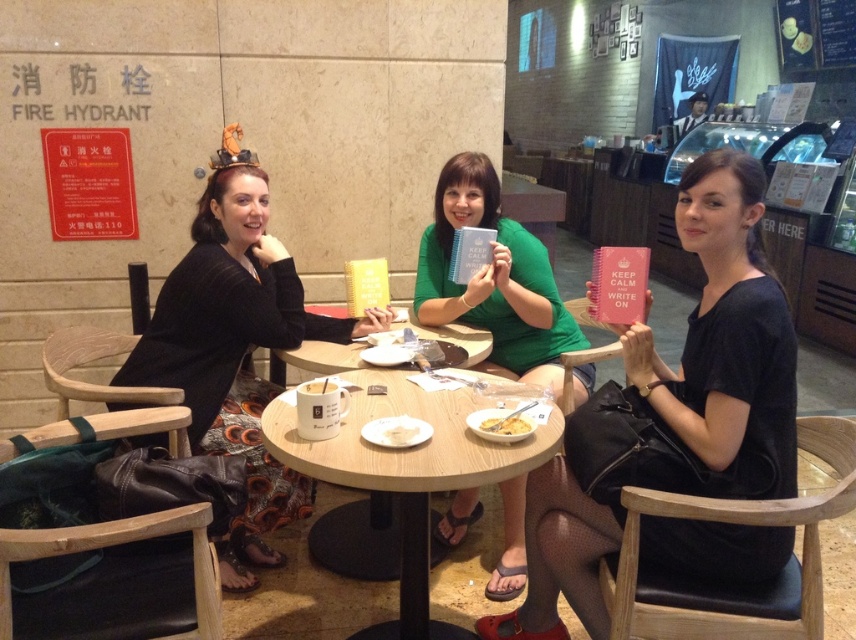
You are a customer at the cafe and want to grab the white matte mug at center without touching the green matte notebook at center. Can you reach it easily?

The green matte notebook at center is closer to you than the white matte mug at center, so you can reach the white matte mug at center without touching the notebook by moving your hand around it.